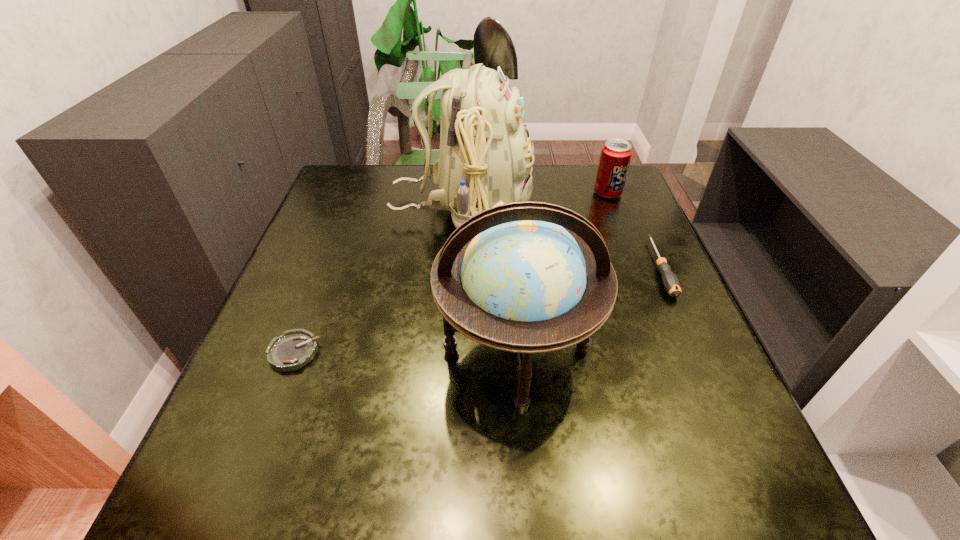
The image size is (960, 540). In order to click on the tallest object in this screenshot , I will do `click(485, 160)`.

The height and width of the screenshot is (540, 960). Find the location of `the fourth shortest object`. the fourth shortest object is located at coordinates (536, 277).

Find the location of a particular element. soda can is located at coordinates (616, 154).

The width and height of the screenshot is (960, 540). In order to click on screwdriver in this screenshot , I will do `click(671, 283)`.

Find the location of a particular element. The height and width of the screenshot is (540, 960). ashtray is located at coordinates (295, 348).

At what (x,y) coordinates should I click in order to perform the action: click on the leftmost object. Please return your answer as a coordinate pair (x, y). This screenshot has height=540, width=960. Looking at the image, I should click on (295, 348).

Locate an element on the screen. The image size is (960, 540). free spot located 0.260m on the front-facing side of the backpack is located at coordinates (626, 206).

This screenshot has height=540, width=960. I want to click on vacant space located 0.150m on the surface of the second tallest object, so point(529,518).

Image resolution: width=960 pixels, height=540 pixels. Find the location of `vacant space located on the left of the soda can`. vacant space located on the left of the soda can is located at coordinates (513, 193).

Image resolution: width=960 pixels, height=540 pixels. Find the location of `free space located 0.220m on the back of the second shortest object`. free space located 0.220m on the back of the second shortest object is located at coordinates (626, 192).